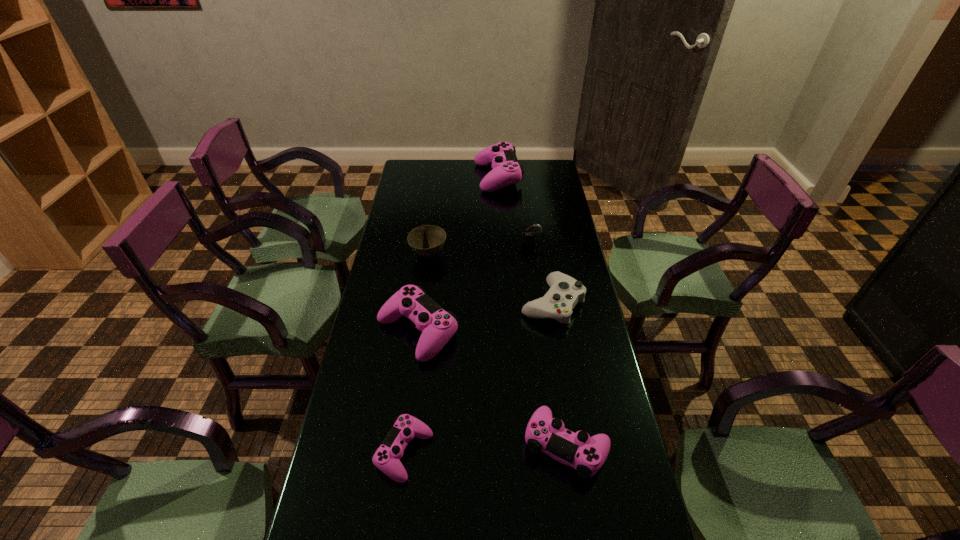
Select which control appears as the second closest to the second smallest pink control. Please provide its 2D coordinates. Your answer should be formatted as a tuple, i.e. [(x, y)], where the tuple contains the x and y coordinates of a point satisfying the conditions above.

[(437, 326)]

This screenshot has height=540, width=960. What are the coordinates of `pink control that can be found as the fourth closest to the white control` in the screenshot? It's located at (506, 170).

Image resolution: width=960 pixels, height=540 pixels. I want to click on pink control that is the fourth closest to the white control, so click(x=506, y=170).

This screenshot has width=960, height=540. Identify the location of blank area in the image that satisfies the following two spatial constraints: 1. on the back side of the third smallest pink control; 2. on the right side of the bowl. (428, 254).